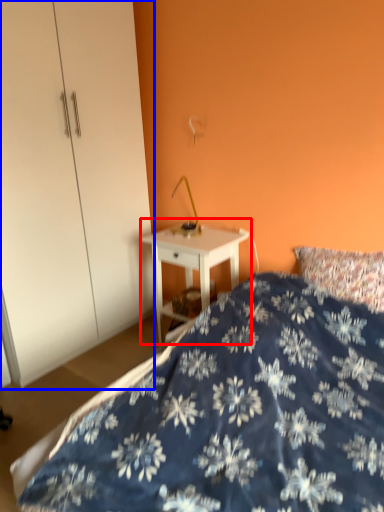
Question: Which object appears farthest to the camera in this image, nightstand (highlighted by a red box) or dresser (highlighted by a blue box)?

Choices:
 (A) nightstand
 (B) dresser

Answer: (A)